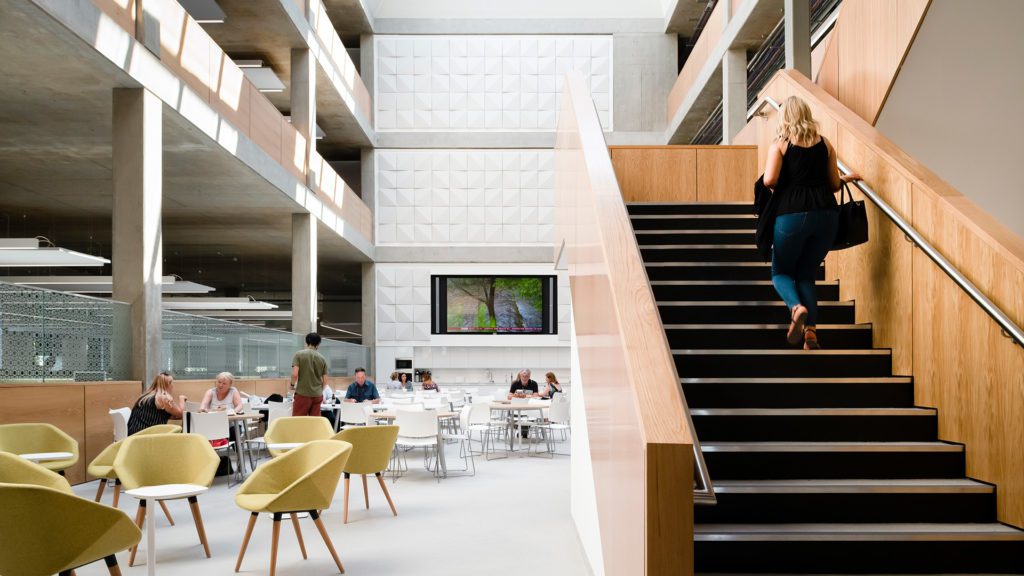
Identify the location of yellow chair. (66, 541), (25, 467), (35, 439), (108, 461), (154, 469), (297, 423), (300, 480), (372, 439).